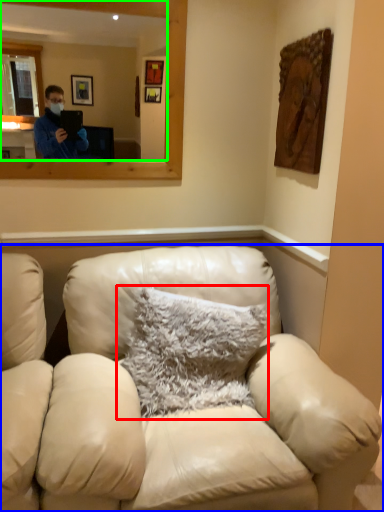
Question: Considering the real-world distances, which object is closest to pillow (highlighted by a red box)? studio couch (highlighted by a blue box) or mirror (highlighted by a green box).

Choices:
 (A) studio couch
 (B) mirror

Answer: (A)